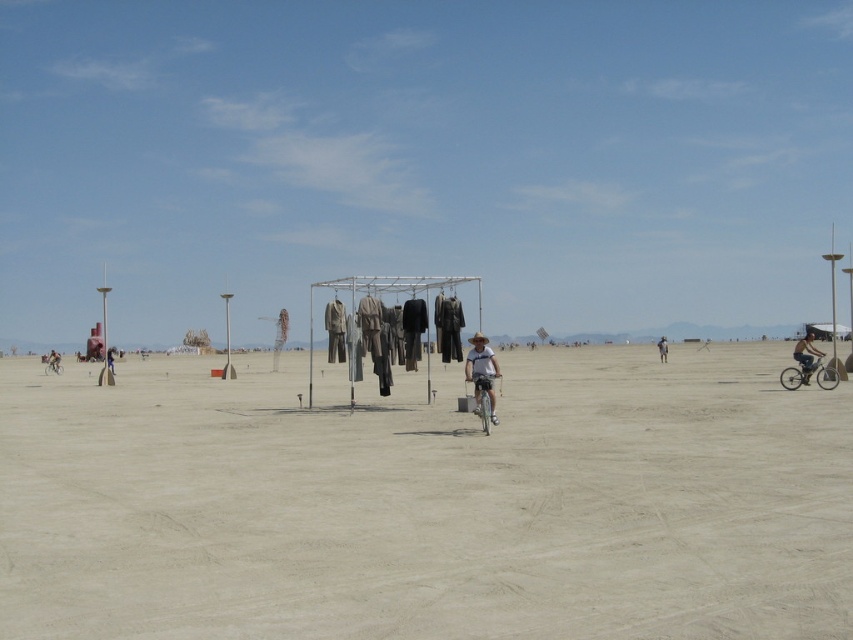
Question: Does silver metallic bicycle at center have a greater width compared to brown fabric at center?

Choices:
 (A) no
 (B) yes

Answer: (A)

Question: Can you confirm if white cotton shirt at center is positioned to the right of matte black bicycle at center?

Choices:
 (A) yes
 (B) no

Answer: (A)

Question: Which point is closer to the camera taking this photo?

Choices:
 (A) (483, 381)
 (B) (32, 508)

Answer: (B)

Question: Is sandy beige dirt at center positioned at the back of matte black bicycle at right?

Choices:
 (A) yes
 (B) no

Answer: (B)

Question: Which object is the farthest from the brown fabric at center?

Choices:
 (A) white cotton shirt at center
 (B) silver metallic bicycle at lower left

Answer: (A)

Question: Which object is the farthest from the silver metallic bicycle at right?

Choices:
 (A) silver metallic bicycle at lower left
 (B) white cotton shirt at center

Answer: (A)